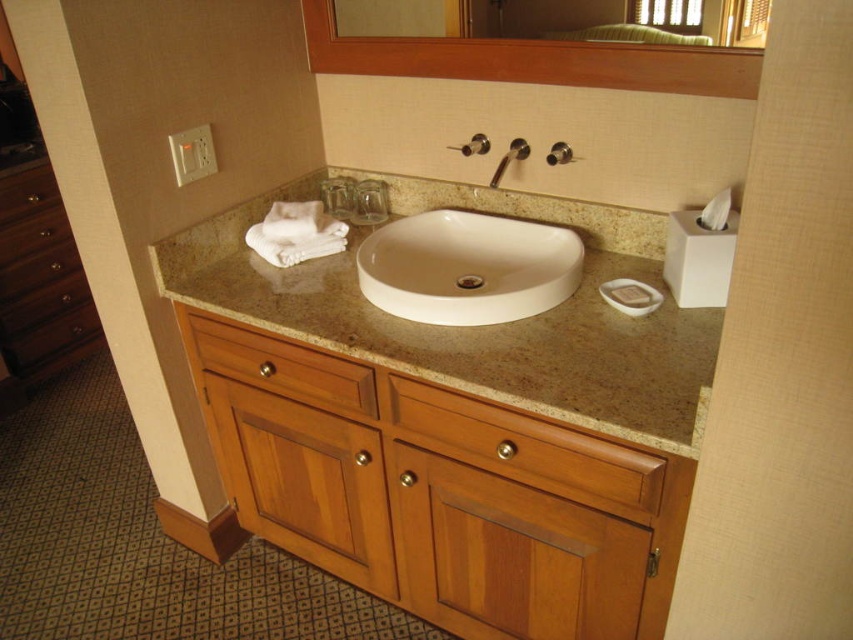
You are a guest in this bathroom and need to locate the white plastic soap dispenser at upper right. Where should you look relative to the clear glass mirror at upper center?

The white plastic soap dispenser at upper right is below the clear glass mirror at upper center.

You are organizing the bathroom and need to place a new 15 cm wide decorative vase. The beige granite countertop at center and the white plastic soap dispenser at upper right are both potential spots. Which location can accommodate the vase without overcrowding?

The beige granite countertop at center has a larger size compared to the white plastic soap dispenser at upper right, so the vase can be placed there without overcrowding.